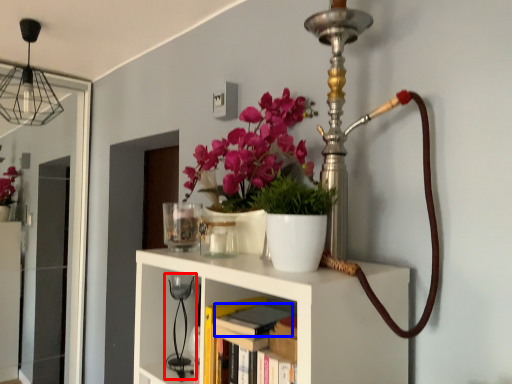
Question: Among these objects, which one is farthest to the camera, table lamp (highlighted by a red box) or book (highlighted by a blue box)?

Choices:
 (A) table lamp
 (B) book

Answer: (A)